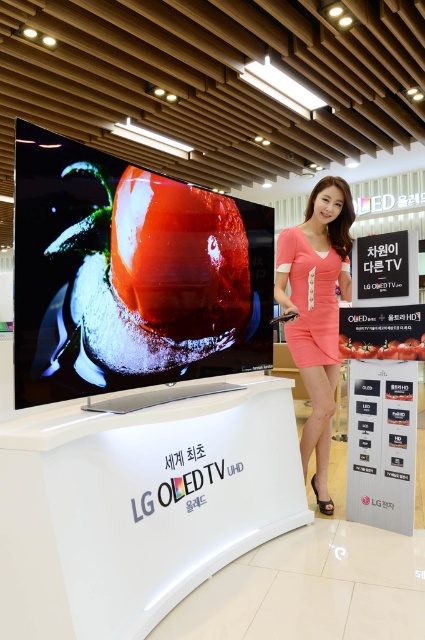
Is pink fabric dress at center to the right of pink satin dress at center from the viewer's perspective?

No, pink fabric dress at center is not to the right of pink satin dress at center.

Does pink fabric dress at center appear under pink satin dress at center?

Correct, pink fabric dress at center is located below pink satin dress at center.

Is point (328, 416) positioned before point (295, 301)?

That is True.

Where is `pink fabric dress at center`? The width and height of the screenshot is (425, 640). pink fabric dress at center is located at coordinates (317, 310).